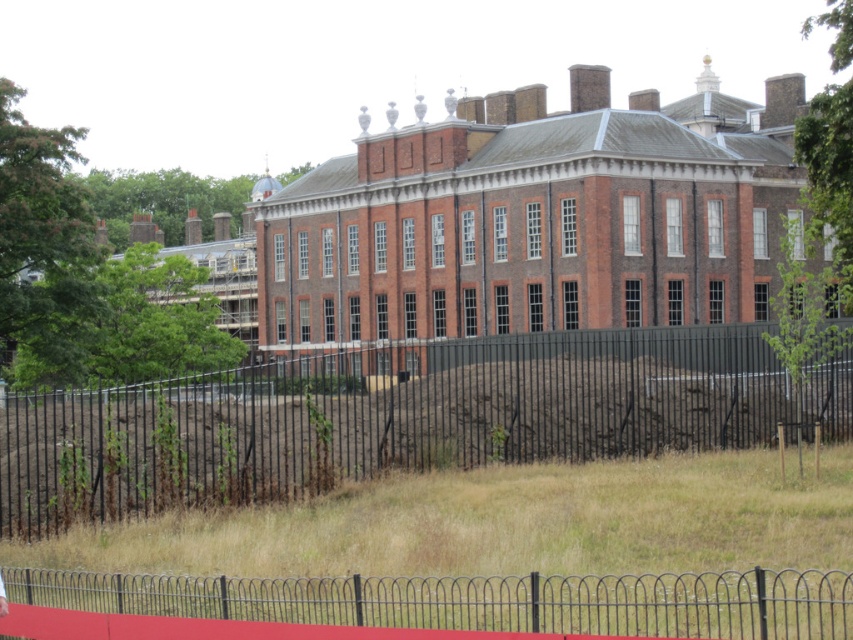
Based on the photo, you are a delivery person trying to determine the best path to approach the historic brick building. You notice two fences in your way. Which fence must you go around first, the black metal fence at center or the metallic wire fence at lower center?

You must go around the metallic wire fence at lower center first because the black metal fence at center is positioned over it, meaning the metallic wire fence is closer to you.

In the scene shown: You are standing in front of the historic brick building and want to locate the point at coordinates point (383, 419). According to the scene, where exactly is this point located?

The point (383, 419) is located on the black metal fence at center.